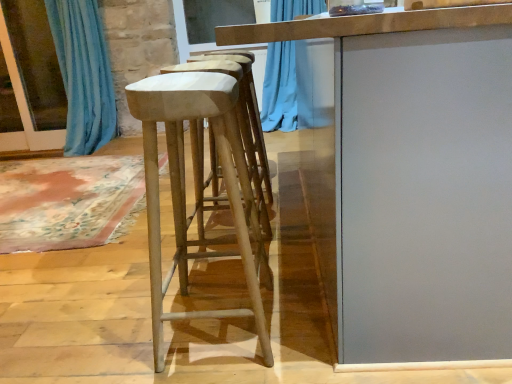
This screenshot has height=384, width=512. Find the location of `unoccupied region to the right of light brown wood stool at center`. unoccupied region to the right of light brown wood stool at center is located at coordinates (306, 317).